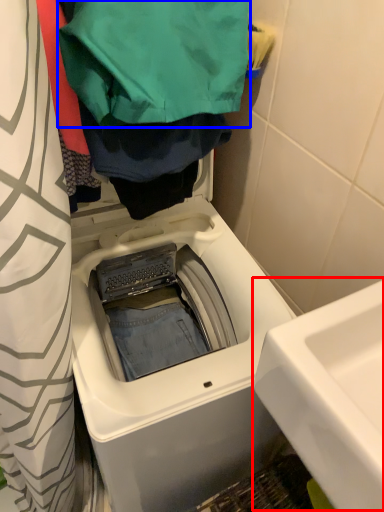
Question: Which point is further to the camera, sink (highlighted by a red box) or clothing (highlighted by a blue box)?

Choices:
 (A) sink
 (B) clothing

Answer: (B)